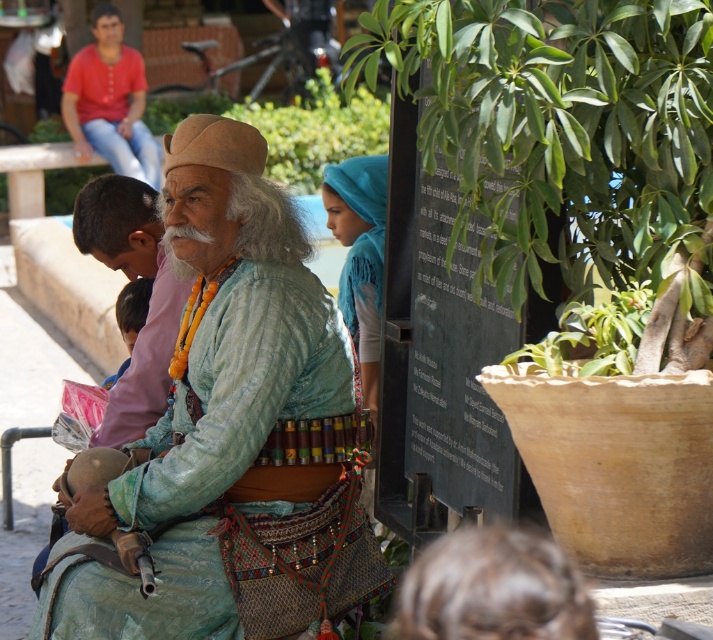
Question: Does turquoise fabric at center appear on the right side of pink fabric at center?

Choices:
 (A) no
 (B) yes

Answer: (B)

Question: Does turquoise fabric at center have a lesser width compared to pink fabric at center?

Choices:
 (A) no
 (B) yes

Answer: (A)

Question: Among these points, which one is farthest from the camera?

Choices:
 (A) [175, 324]
 (B) [56, 605]

Answer: (A)

Question: Is pink fabric at center thinner than matte red shirt at upper left?

Choices:
 (A) yes
 (B) no

Answer: (A)

Question: Based on their relative distances, which object is farther from the matte red shirt at upper left?

Choices:
 (A) pink fabric at center
 (B) turquoise fabric at center

Answer: (B)

Question: Which object appears farthest from the camera in this image?

Choices:
 (A) pink fabric at center
 (B) turquoise fabric at center
 (C) matte red shirt at upper left

Answer: (C)